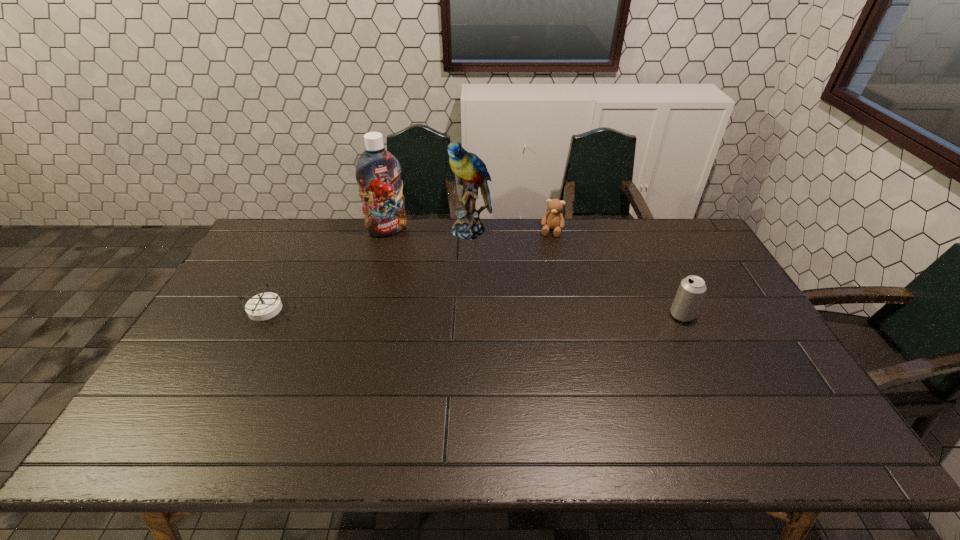
In order to click on vacant space located on the face of the third object from left to right in this screenshot , I will do `click(438, 288)`.

Where is `blank area located 0.360m on the front label of the second object from left to right`? This screenshot has width=960, height=540. blank area located 0.360m on the front label of the second object from left to right is located at coordinates (438, 297).

At what (x,y) coordinates should I click in order to perform the action: click on vacant space located on the front label of the second object from left to right. Please return your answer as a coordinate pair (x, y). Looking at the image, I should click on (422, 275).

The image size is (960, 540). Find the location of `free location located 0.250m on the front label of the second object from left to right`. free location located 0.250m on the front label of the second object from left to right is located at coordinates (423, 276).

Find the location of a particular element. The image size is (960, 540). vacant space located 0.340m on the front-facing side of the teddy bear is located at coordinates (536, 302).

Find the location of a particular element. This screenshot has width=960, height=540. vacant position located 0.110m on the front-facing side of the teddy bear is located at coordinates (546, 256).

Locate an element on the screen. free space located 0.070m on the front-facing side of the teddy bear is located at coordinates (548, 250).

The image size is (960, 540). I want to click on parrot located at the far edge, so click(471, 171).

Where is `shampoo that is at the far edge`? This screenshot has height=540, width=960. shampoo that is at the far edge is located at coordinates (378, 172).

Locate an element on the screen. The height and width of the screenshot is (540, 960). teddy bear located in the far edge section of the desktop is located at coordinates (553, 219).